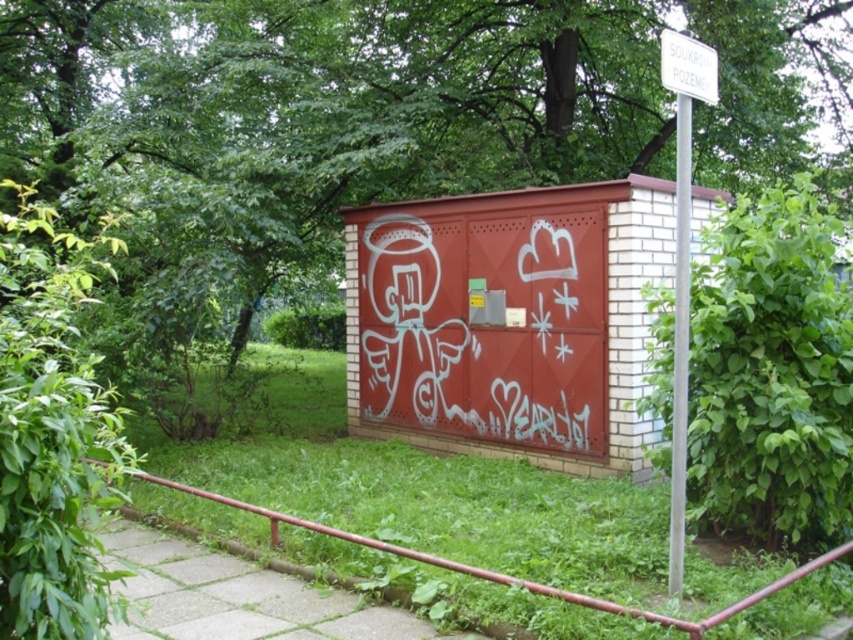
You are a painter standing in front of the structure and want to hang a new sign that is 1 meter wide. The existing white plastic sign at upper right is currently in place. Can the new sign fit in the same space without overlapping the red metal rail at lower left?

The white plastic sign at upper right has a lesser width compared to the red metal rail at lower left, so the new sign that is 1 meter wide may not fit in the same space without overlapping the red metal rail at lower left if the existing sign is smaller than 1 meter. However, since the description only mentions the width comparison between the two objects and not their exact measurements, it is unclear if there is enough space. Further measurement would be needed.

You are standing in front of the structure with the red metal door and graffiti. You notice two points marked on the structure. The first point is at coordinates point [668,42] and the second is at point [575,598]. If you want to touch both points starting from the nearest one, which point should you reach for first?

You should reach for point [668,42] first because it is closer to you than point [575,598], which is further away.